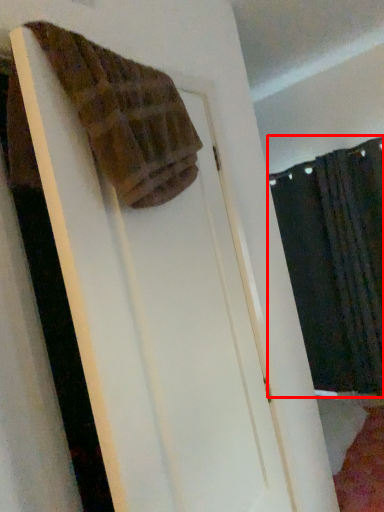
Question: From the image's perspective, considering the relative positions of curtain (annotated by the red box) and towel in the image provided, where is curtain (annotated by the red box) located with respect to the staircase?

Choices:
 (A) below
 (B) above

Answer: (A)